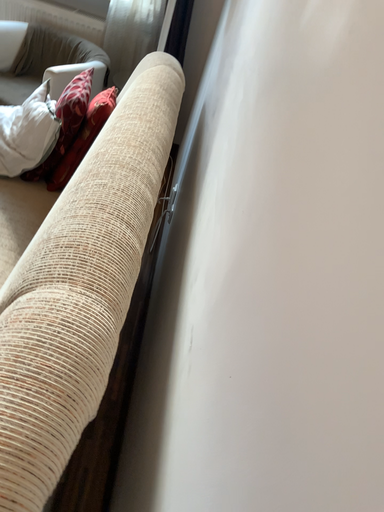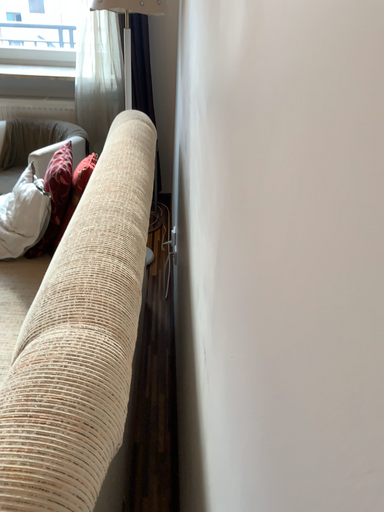
Question: How did the camera likely rotate when shooting the video?

Choices:
 (A) rotated upward
 (B) rotated downward

Answer: (A)